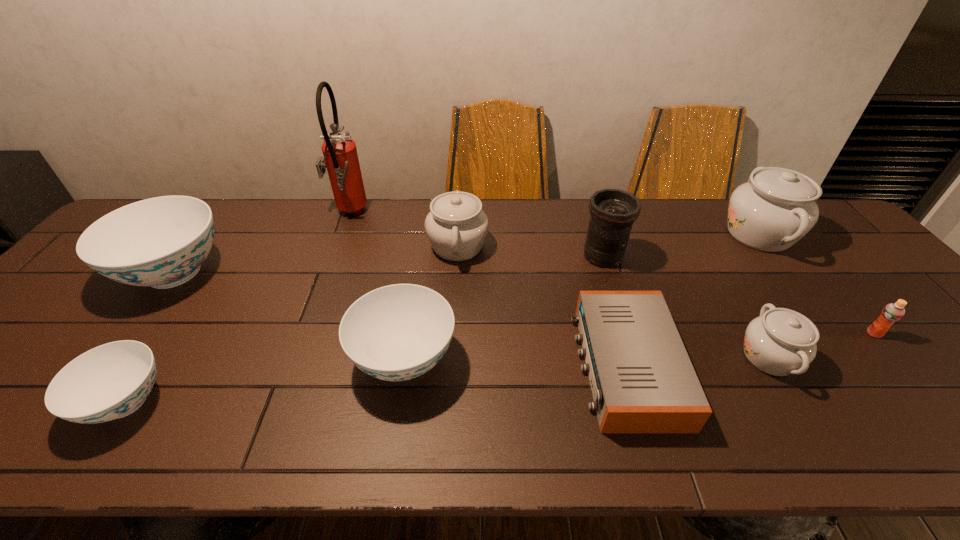
The width and height of the screenshot is (960, 540). I want to click on orange juice, so click(892, 312).

Image resolution: width=960 pixels, height=540 pixels. What are the coordinates of `the shortest chinaware` in the screenshot? It's located at (111, 381).

You are a GUI agent. You are given a task and a screenshot of the screen. Output one action in this format:
    pyautogui.click(x=<x>, y=<y>)
    Task: Click on the radio receiver
    
    Given the screenshot: What is the action you would take?
    pyautogui.click(x=642, y=380)

The image size is (960, 540). What are the coordinates of `blank space located 0.270m at the nozzle of the eighth object from right to left` in the screenshot? It's located at (450, 214).

The height and width of the screenshot is (540, 960). In order to click on blank area located 0.130m on the right of the biggest white chinaware in this screenshot , I will do `click(839, 234)`.

Find the location of `free space located on the back of the telephoto lens`. free space located on the back of the telephoto lens is located at coordinates (595, 232).

The height and width of the screenshot is (540, 960). In order to click on vacant region located on the right of the second biggest white chinaware in this screenshot , I will do `click(549, 246)`.

Image resolution: width=960 pixels, height=540 pixels. I want to click on vacant position located 0.160m on the front of the farthest blue chinaware, so click(105, 365).

The image size is (960, 540). In order to click on free space located 0.190m on the right of the second chinaware from right to left in this screenshot , I will do `click(881, 357)`.

What are the coordinates of `vacant region located on the left of the second biggest blue chinaware` in the screenshot? It's located at (277, 359).